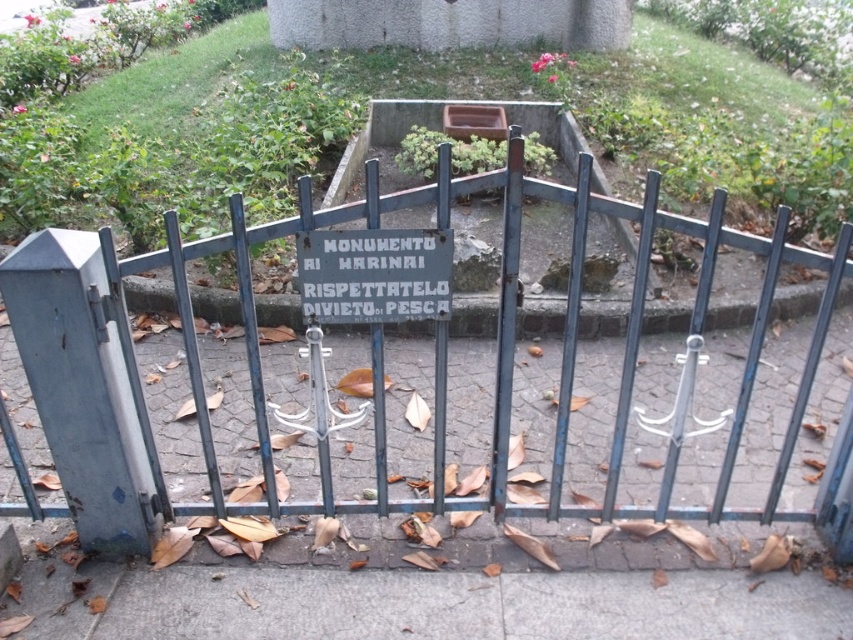
What is the 2D coordinate of the blue painted metal gate at center?

The blue painted metal gate at center is located at the 2D coordinate point of (434, 362).

What is the relationship between the size of the gray metallic gate at left and the white stone sign at center?

The gray metallic gate at left is larger in size compared to the white stone sign at center.